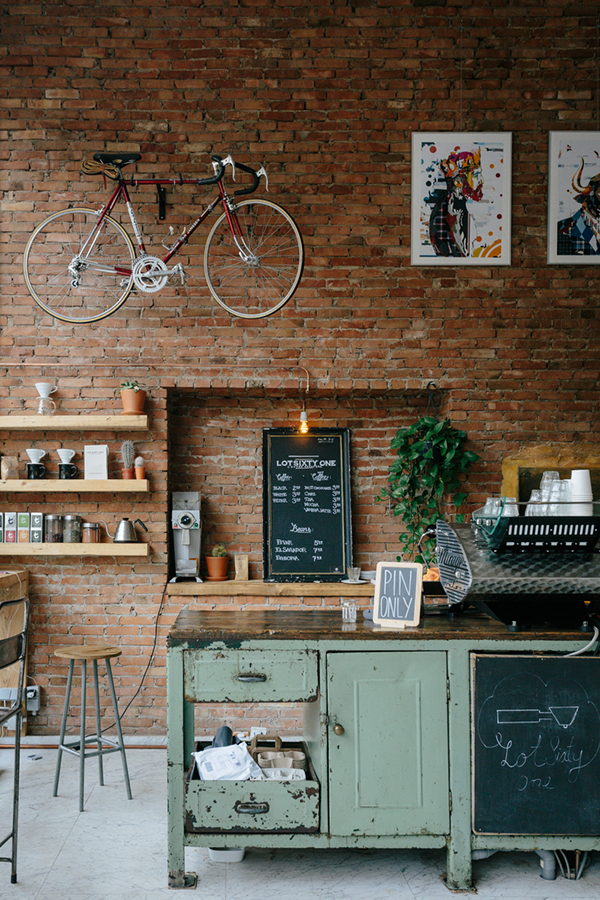
The height and width of the screenshot is (900, 600). Identify the location of cables. (560, 866), (566, 865), (578, 876), (156, 631), (33, 680).